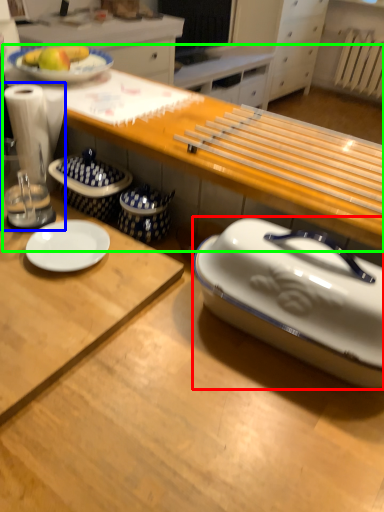
Question: Which object is positioned farthest from tableware (highlighted by a red box)? Select from blender (highlighted by a blue box) and table (highlighted by a green box).

Choices:
 (A) blender
 (B) table

Answer: (A)